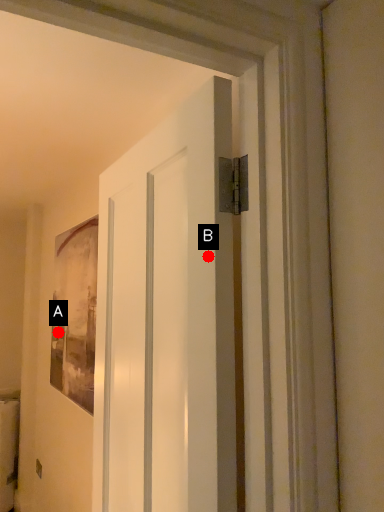
Question: Two points are circled on the image, labeled by A and B beside each circle. Which point is closer to the camera?

Choices:
 (A) A is closer
 (B) B is closer

Answer: (B)